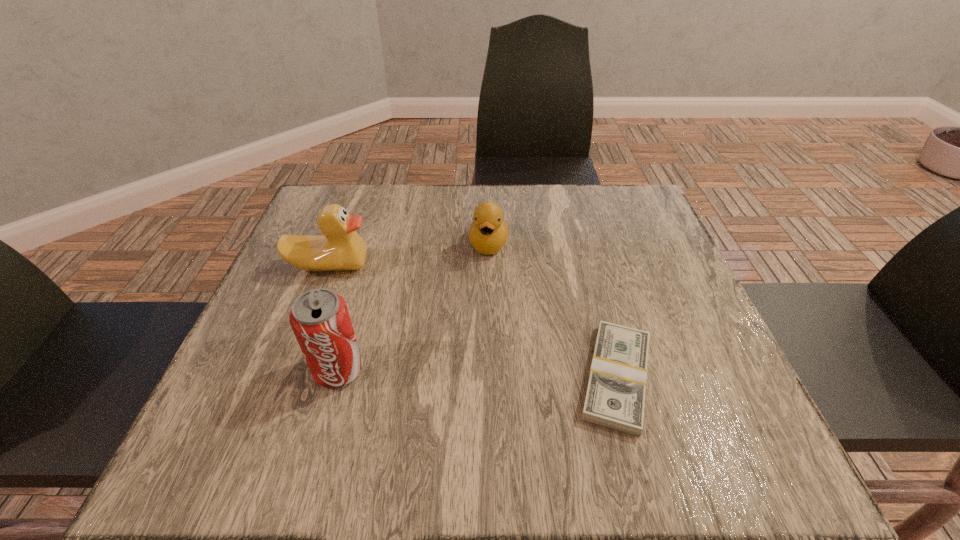
I want to click on soda can, so click(x=319, y=318).

Identify the location of the rightmost object. This screenshot has width=960, height=540. (615, 397).

Where is `the shortest object`? This screenshot has width=960, height=540. the shortest object is located at coordinates (615, 397).

Identify the location of the third object from left to right. This screenshot has width=960, height=540. (488, 233).

You are a GUI agent. You are given a task and a screenshot of the screen. Output one action in this format:
    pyautogui.click(x=<x>, y=<y>)
    Task: Click on the duckling
    The height and width of the screenshot is (540, 960).
    Given the screenshot: What is the action you would take?
    pyautogui.click(x=488, y=233)

I want to click on the second tallest object, so click(341, 248).

Identify the location of free region located 0.050m on the right of the soda can. (391, 370).

Locate an element on the screen. This screenshot has width=960, height=540. vacant space located on the back of the shortest object is located at coordinates (583, 249).

Where is `vacant region located on the face of the second shortest object`? This screenshot has width=960, height=540. vacant region located on the face of the second shortest object is located at coordinates (477, 360).

Where is `free spot located on the face of the second shortest object`? The width and height of the screenshot is (960, 540). free spot located on the face of the second shortest object is located at coordinates (477, 360).